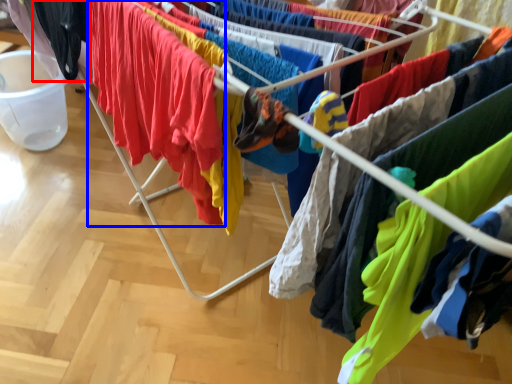
Question: Which point is further to the camera, clothing (highlighted by a red box) or clothing (highlighted by a blue box)?

Choices:
 (A) clothing
 (B) clothing

Answer: (A)